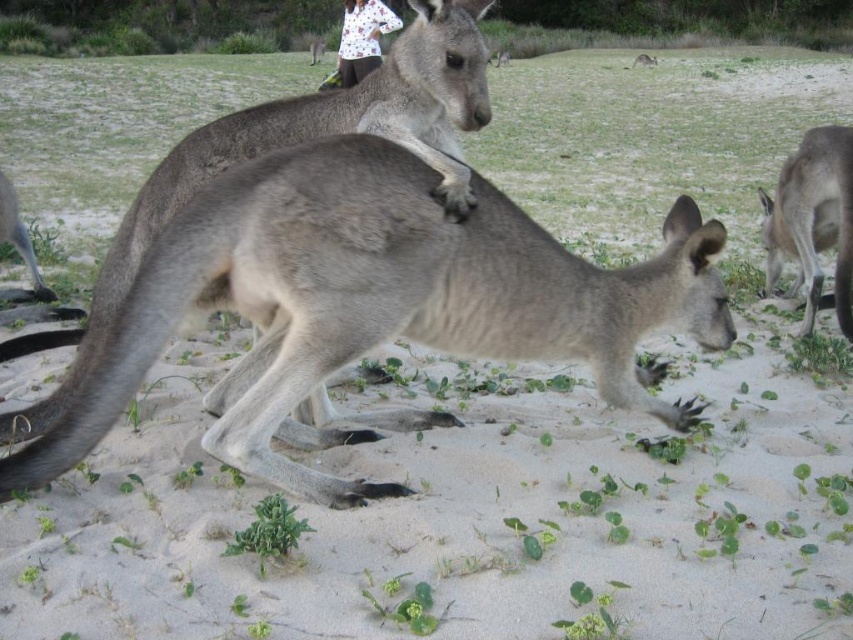
You are a photographer trying to capture a clear shot of the gray fur kangaroo at center and the white printed shirt at upper center. Which object is closer to the camera?

The gray fur kangaroo at center is positioned under the white printed shirt at upper center, so the white printed shirt at upper center is closer to the camera.